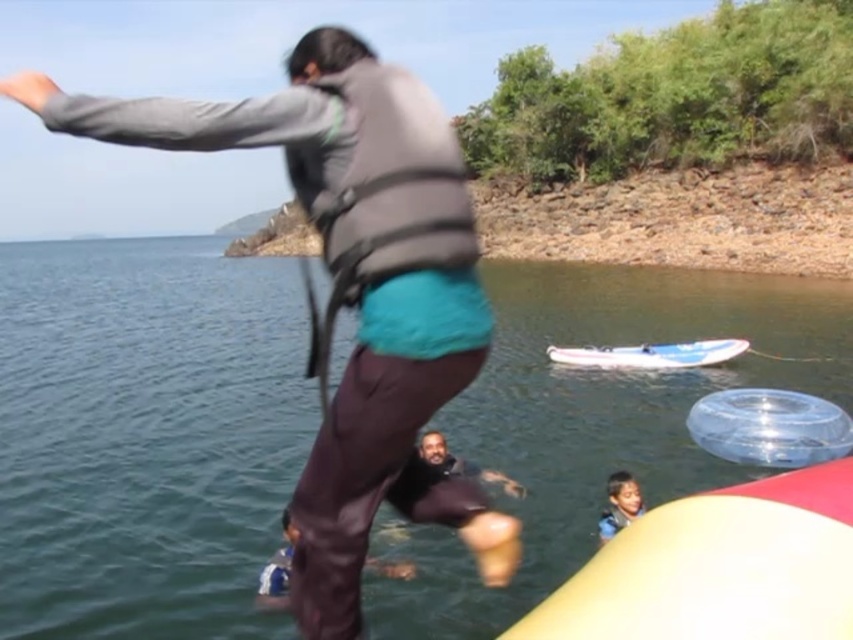
You are a photographer standing on the lakeside. You want to capture a photo of the clear blue water at center and the smooth skin child at lower right. Which object should you focus on first to ensure it appears sharp in the photo?

The clear blue water at center is in front of the smooth skin child at lower right, so you should focus on the clear blue water at center first to ensure it appears sharp in the photo.

You are standing at the lakeside and want to reach the point marked as point (601, 324). If your maximum walking distance is 20 meters, can you reach it without swimming?

The distance between point (601, 324) and the viewer is 22.43 meters, which exceeds your maximum walking distance of 20 meters. Therefore, you cannot reach it without swimming.

You are a lifeguard observing the scene. The person is jumping into the clear blue water at center and wearing the matte gray life vest at center. Which object is located to the right of the other?

The matte gray life vest at center is to the right of the clear blue water at center because the clear blue water at center is positioned on the left side of the matte gray life vest at center.